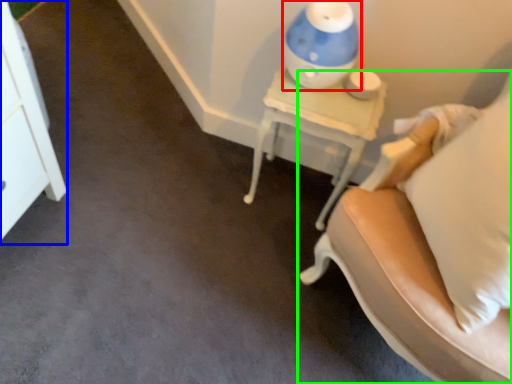
Question: Considering the real-world distances, which object is farthest from table lamp (highlighted by a red box)? dresser (highlighted by a blue box) or furniture (highlighted by a green box)?

Choices:
 (A) dresser
 (B) furniture

Answer: (A)